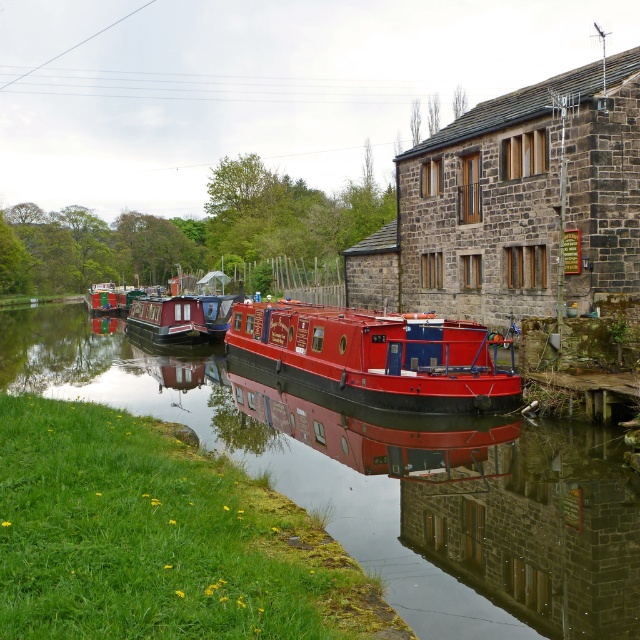
Question: Which object appears closest to the camera in this image?

Choices:
 (A) red polished wooden boat at center
 (B) shiny red barge at center
 (C) smooth red canal boat at center

Answer: (C)

Question: Which object is closer to the camera taking this photo?

Choices:
 (A) metallic red canal boat at left
 (B) smooth red canal boat at center

Answer: (B)

Question: Is shiny red barge at center smaller than metallic red canal boat at left?

Choices:
 (A) no
 (B) yes

Answer: (B)

Question: Does red polished wooden boat at center appear over metallic red canal boat at left?

Choices:
 (A) yes
 (B) no

Answer: (B)

Question: Which object appears farthest from the camera in this image?

Choices:
 (A) shiny red barge at center
 (B) red polished wooden boat at center

Answer: (B)

Question: Considering the relative positions of smooth red canal boat at center and metallic red canal boat at left in the image provided, where is smooth red canal boat at center located with respect to metallic red canal boat at left?

Choices:
 (A) above
 (B) below

Answer: (B)